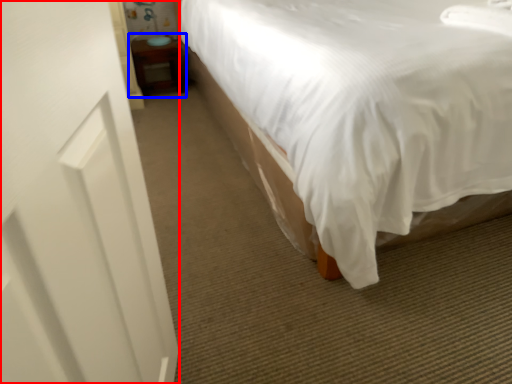
Question: Which object is further to the camera taking this photo, screen door (highlighted by a red box) or table (highlighted by a blue box)?

Choices:
 (A) screen door
 (B) table

Answer: (B)